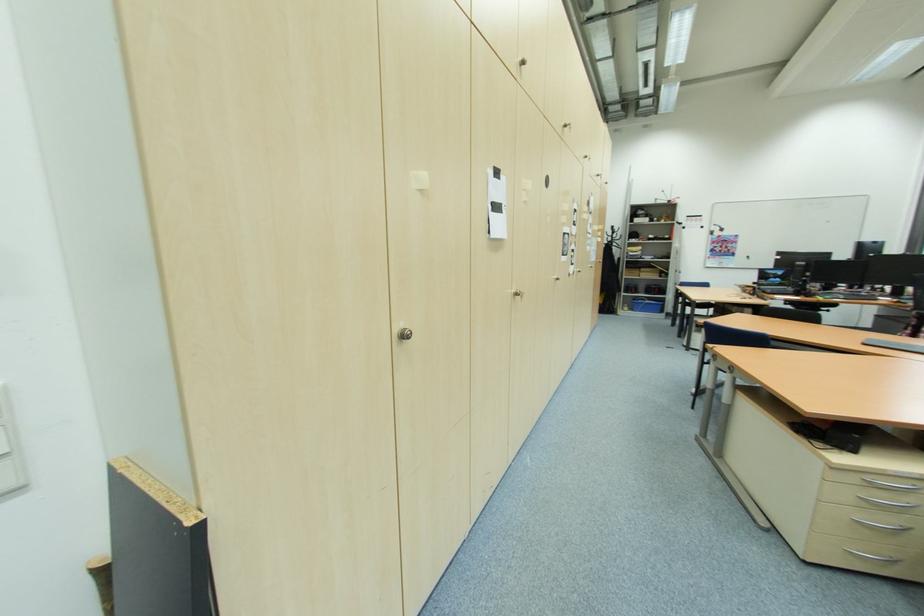
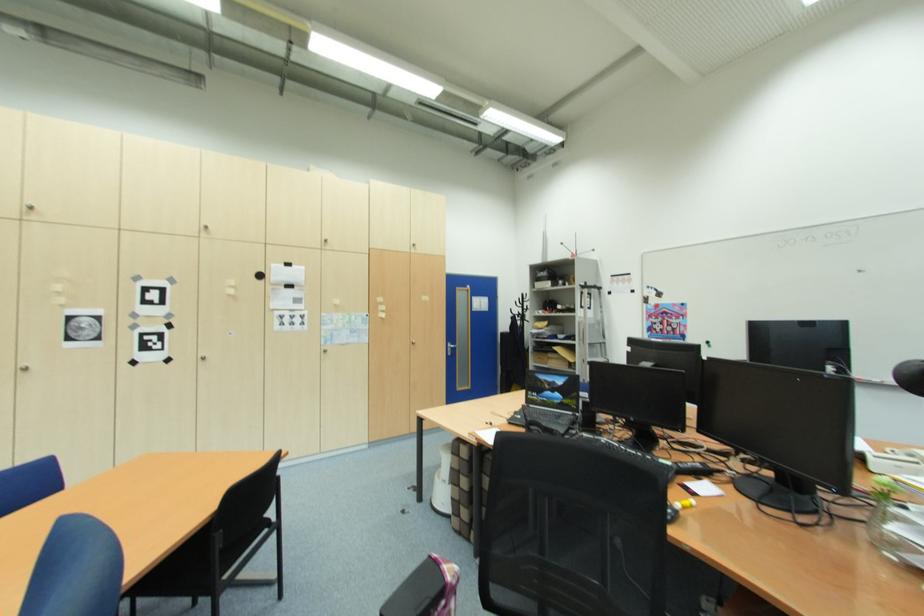
The point at (582,272) is marked in the first image. Where is the corresponding point in the second image?

(208, 360)